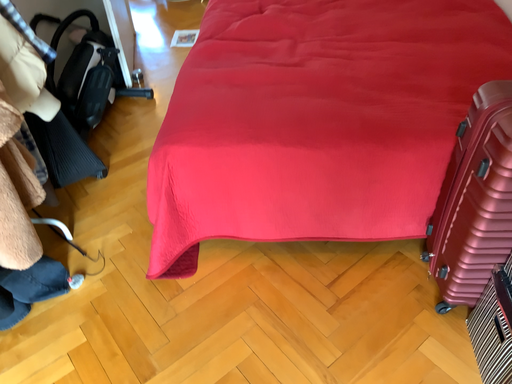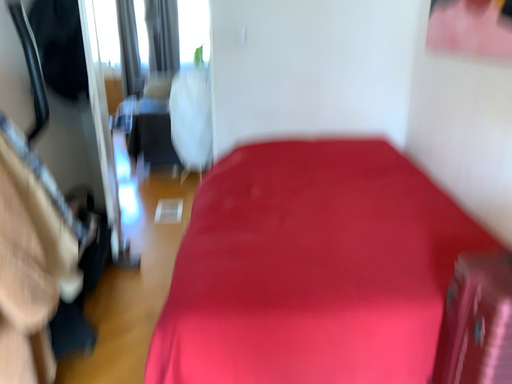
Question: Which way did the camera rotate in the video?

Choices:
 (A) rotated upward
 (B) rotated downward

Answer: (A)